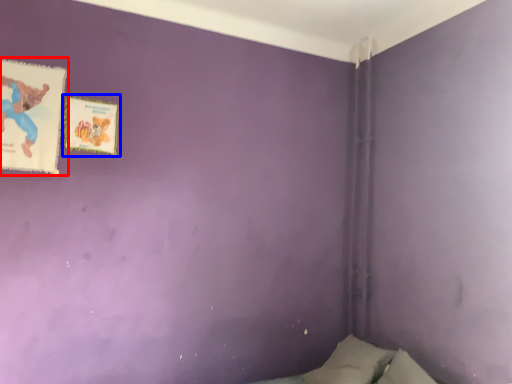
Question: Among these objects, which one is farthest to the camera, paperback book (highlighted by a red box) or paperback book (highlighted by a blue box)?

Choices:
 (A) paperback book
 (B) paperback book

Answer: (B)